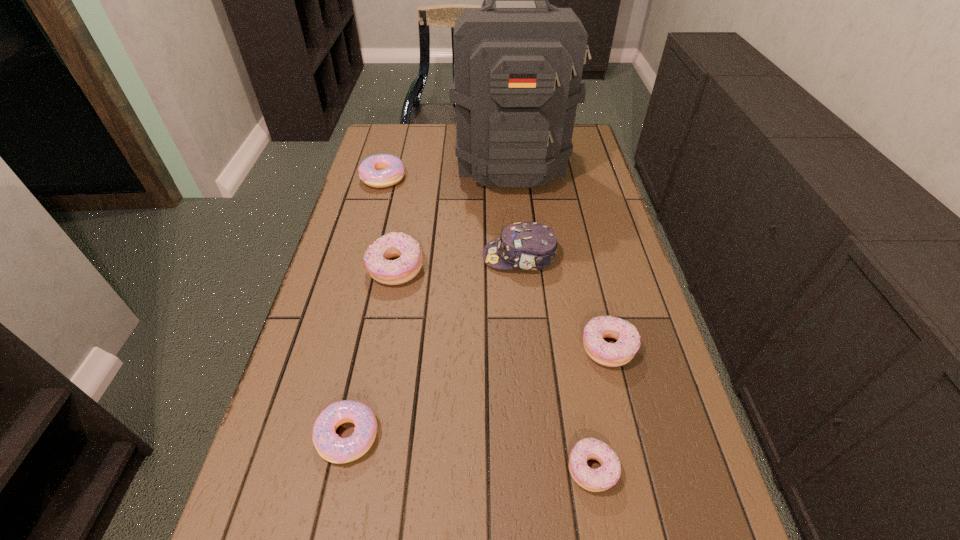
The width and height of the screenshot is (960, 540). I want to click on the tallest object, so click(x=517, y=71).

Locate an element on the screen. The height and width of the screenshot is (540, 960). backpack is located at coordinates (517, 71).

The width and height of the screenshot is (960, 540). Find the location of `the sixth shortest object`. the sixth shortest object is located at coordinates (523, 245).

This screenshot has height=540, width=960. I want to click on the fifth shortest object, so click(376, 258).

The width and height of the screenshot is (960, 540). Identify the location of the leftmost purple doughnut. (376, 258).

Identify the location of the bigger pink doughnut. (382, 170).

This screenshot has height=540, width=960. I want to click on the farther pink doughnut, so click(x=382, y=170).

Image resolution: width=960 pixels, height=540 pixels. Identify the location of the second nearest purple doughnut. (628, 339).

Locate an element on the screen. the third nearest doughnut is located at coordinates (628, 339).

You are a GUI agent. You are given a task and a screenshot of the screen. Output one action in this format:
    pyautogui.click(x=<x>, y=<y>)
    Task: Click on the nearer pink doughnut
    
    Given the screenshot: What is the action you would take?
    pyautogui.click(x=331, y=447)